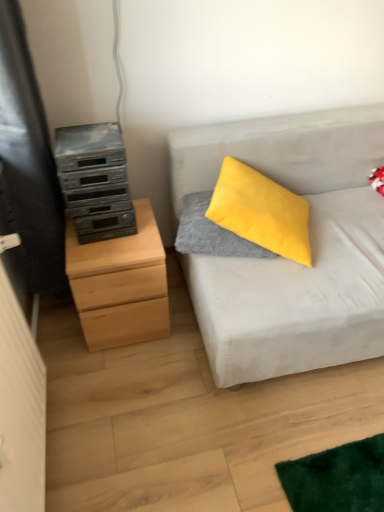
Question: Is light gray fabric couch at right bigger or smaller than silver metallic stereo at left?

Choices:
 (A) big
 (B) small

Answer: (A)

Question: Would you say light gray fabric couch at right is to the left or to the right of silver metallic stereo at left in the picture?

Choices:
 (A) left
 (B) right

Answer: (B)

Question: Based on their relative distances, which object is nearer to the velvety gray pillow at center?

Choices:
 (A) natural wood chest of drawers at left
 (B) silver metallic stereo at left
 (C) light gray fabric couch at right

Answer: (C)

Question: Which object is positioned closest to the silver metallic stereo at left?

Choices:
 (A) natural wood chest of drawers at left
 (B) velvety gray pillow at center
 (C) light gray fabric couch at right

Answer: (A)